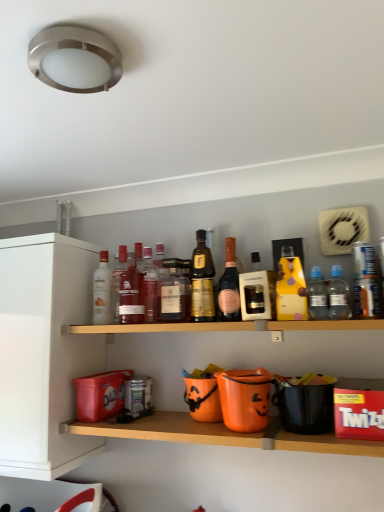
Question: Considering their positions, is gold metallic bottle at center, which ranks as the 6th bottle in left-to-right order, located in front of or behind pink glass bottle at center, which ranks as the seventh bottle in left-to-right order?

Choices:
 (A) behind
 (B) front

Answer: (A)

Question: From the image's perspective, relative to pink glass bottle at center, which ranks as the seventh bottle in left-to-right order, is gold metallic bottle at center, which ranks as the 6th bottle in left-to-right order, above or below?

Choices:
 (A) below
 (B) above

Answer: (B)

Question: Which object is the closest to the orange plastic buckets at lower center, the 1th shelf ordered from the bottom?

Choices:
 (A) clear plastic bottle at right, the 9th bottle positioned from the left
 (B) matte glass bottle at center, which is the sixth bottle in right-to-left order
 (C) clear plastic bottle at center right, which appears as the 8th bottle when viewed from the left
 (D) wooden shelf at center, the 1th shelf from the top
 (E) white matte cabinet at left

Answer: (D)

Question: Estimate the real-world distances between objects in this image. Which object is closer to the orange plastic buckets at lower center, the 1th shelf ordered from the bottom?

Choices:
 (A) clear plastic bottle at center right, which appears as the 8th bottle when viewed from the left
 (B) matte glass bottle at center, acting as the second bottle starting from the left
 (C) pink glass bottle at center, which ranks as the seventh bottle in left-to-right order
 (D) clear plastic bottle at right, marked as the first bottle in a right-to-left arrangement
 (E) white glass bottle at upper left, which is the ninth bottle in right-to-left order

Answer: (C)